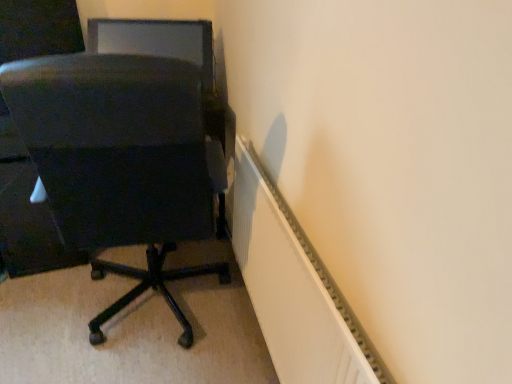
This screenshot has width=512, height=384. Describe the element at coordinates (121, 160) in the screenshot. I see `matte black chair at left` at that location.

What do you see at coordinates (157, 41) in the screenshot? The width and height of the screenshot is (512, 384). I see `matte black monitor at upper left` at bounding box center [157, 41].

Where is `matte black chair at left`? This screenshot has width=512, height=384. matte black chair at left is located at coordinates (121, 160).

Which of these two, matte black chair at left or white ribbed radiator at lower right, stands shorter?

white ribbed radiator at lower right.

Which is correct: matte black chair at left is inside white ribbed radiator at lower right, or outside of it?

matte black chair at left exists outside the volume of white ribbed radiator at lower right.

Who is more distant, matte black chair at left or white ribbed radiator at lower right?

Positioned behind is matte black chair at left.

Is matte black chair at left smaller than white ribbed radiator at lower right?

No.

Does matte black monitor at upper left touch matte black chair at left?

No, matte black monitor at upper left is not touching matte black chair at left.

Does matte black monitor at upper left appear on the left side of matte black chair at left?

Indeed, matte black monitor at upper left is positioned on the left side of matte black chair at left.

Can you confirm if matte black monitor at upper left is smaller than matte black chair at left?

Yes.

Based on the photo, from a real-world perspective, which is physically below, matte black monitor at upper left or matte black chair at left?

From a 3D spatial view, matte black chair at left is below.

From a real-world perspective, between matte black monitor at upper left and white ribbed radiator at lower right, who is vertically higher?

matte black monitor at upper left, from a real-world perspective.

Is the surface of matte black monitor at upper left in direct contact with white ribbed radiator at lower right?

No, matte black monitor at upper left is not in contact with white ribbed radiator at lower right.

In the scene shown: Relative to white ribbed radiator at lower right, is matte black monitor at upper left in front or behind?

matte black monitor at upper left is behind white ribbed radiator at lower right.

Can you confirm if matte black chair at left is bigger than matte black monitor at upper left?

Indeed, matte black chair at left has a larger size compared to matte black monitor at upper left.

Can you confirm if matte black chair at left is shorter than matte black monitor at upper left?

No, matte black chair at left is not shorter than matte black monitor at upper left.

From a real-world perspective, is matte black chair at left physically above matte black monitor at upper left?

No, from a real-world perspective, matte black chair at left is not on top of matte black monitor at upper left.

Is white ribbed radiator at lower right far away from matte black monitor at upper left?

No, white ribbed radiator at lower right is not far from matte black monitor at upper left.

How many degrees apart are the facing directions of white ribbed radiator at lower right and matte black monitor at upper left?

The angular difference between white ribbed radiator at lower right and matte black monitor at upper left is 78.7 degrees.

In terms of size, does white ribbed radiator at lower right appear bigger or smaller than matte black monitor at upper left?

white ribbed radiator at lower right is bigger than matte black monitor at upper left.

Consider the image. From the image's perspective, between white ribbed radiator at lower right and matte black monitor at upper left, which one is located above?

From the image's view, matte black monitor at upper left is above.

Does white ribbed radiator at lower right turn towards matte black chair at left?

Yes, white ribbed radiator at lower right is turned towards matte black chair at left.

Does white ribbed radiator at lower right have a greater height compared to matte black chair at left?

Incorrect, the height of white ribbed radiator at lower right is not larger of that of matte black chair at left.

You are a GUI agent. You are given a task and a screenshot of the screen. Output one action in this format:
    pyautogui.click(x=<x>, y=<y>)
    Task: Click on the chair that appears behind the white ribbed radiator at lower right
    
    Given the screenshot: What is the action you would take?
    pyautogui.click(x=121, y=160)

At what (x,y) coordinates should I click in order to perform the action: click on chair on the left of the white ribbed radiator at lower right. Please return your answer as a coordinate pair (x, y). Looking at the image, I should click on (121, 160).

This screenshot has height=384, width=512. Find the location of `chair below the matte black monitor at upper left (from a real-world perspective)`. chair below the matte black monitor at upper left (from a real-world perspective) is located at coordinates (121, 160).

When comparing their distances from white ribbed radiator at lower right, does matte black chair at left or matte black monitor at upper left seem further?

The object further to white ribbed radiator at lower right is matte black monitor at upper left.

Looking at the image, which one is located further to matte black chair at left, white ribbed radiator at lower right or matte black monitor at upper left?

matte black monitor at upper left is positioned further to the anchor matte black chair at left.

When comparing their distances from matte black chair at left, does matte black monitor at upper left or white ribbed radiator at lower right seem further?

matte black monitor at upper left lies further to matte black chair at left than the other object.

Considering their positions, is matte black monitor at upper left positioned further to white ribbed radiator at lower right than matte black chair at left?

matte black monitor at upper left is further to white ribbed radiator at lower right.

When comparing their distances from matte black monitor at upper left, does white ribbed radiator at lower right or matte black chair at left seem closer?

The object closer to matte black monitor at upper left is matte black chair at left.

Looking at the image, which one is located closer to matte black monitor at upper left, matte black chair at left or white ribbed radiator at lower right?

Based on the image, matte black chair at left appears to be nearer to matte black monitor at upper left.

The height and width of the screenshot is (384, 512). I want to click on chair between matte black monitor at upper left and white ribbed radiator at lower right in the vertical direction, so 121,160.